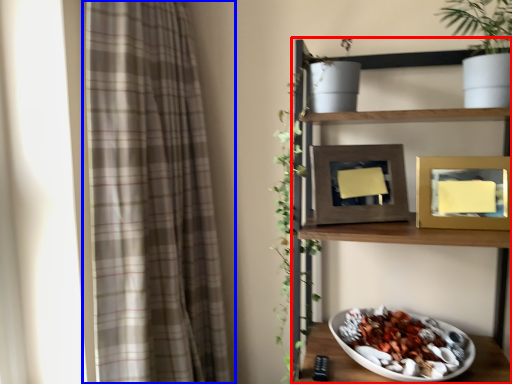
Question: Which object appears closest to the camera in this image, shelf (highlighted by a red box) or curtain (highlighted by a blue box)?

Choices:
 (A) shelf
 (B) curtain

Answer: (A)